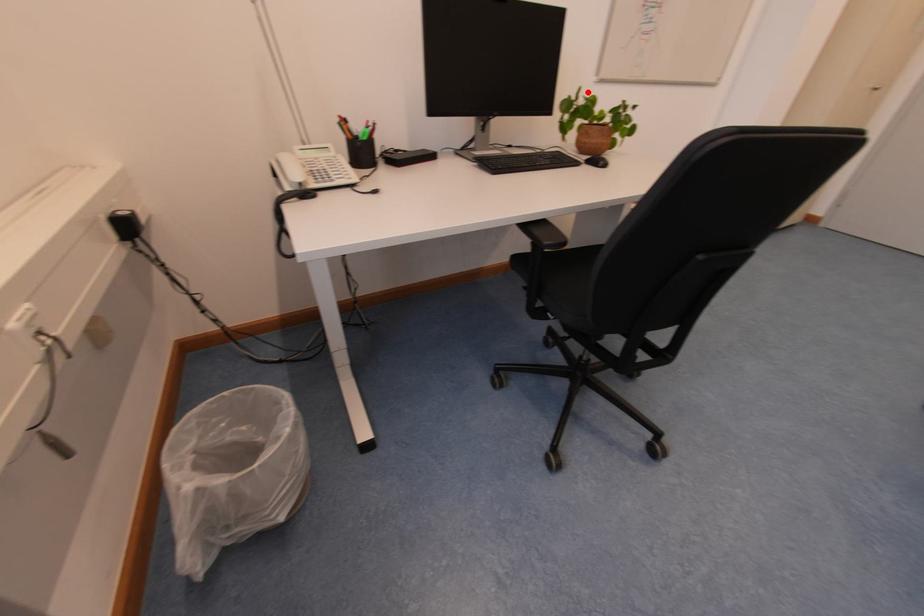
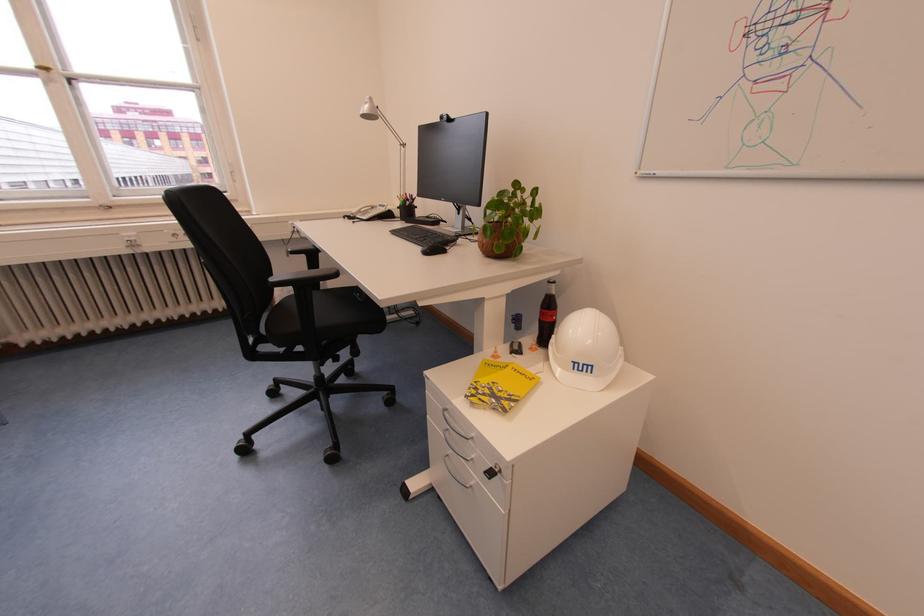
Locate, in the second image, the point that corresponds to the highlighted location in the first image.

(524, 187)